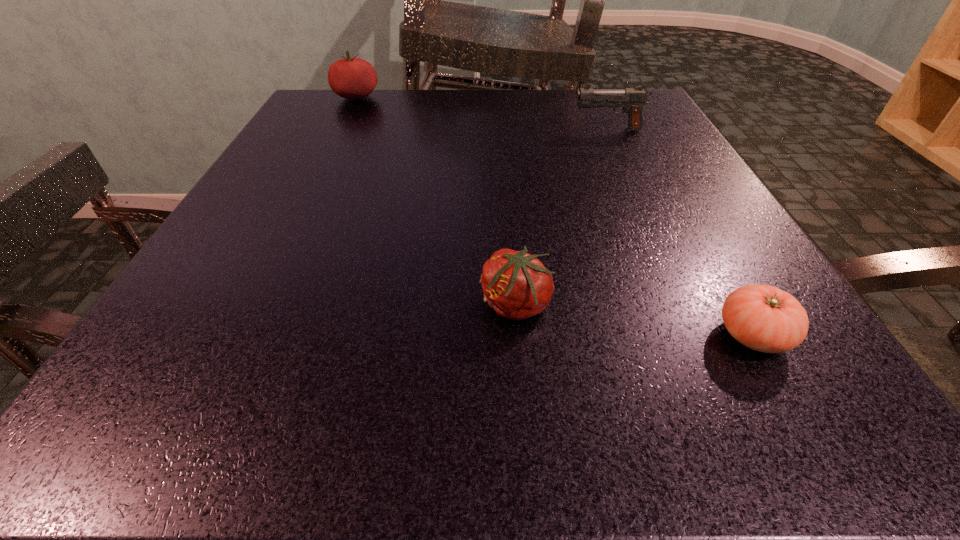
Where is `free location located on the back of the rightmost tomato`? free location located on the back of the rightmost tomato is located at coordinates (716, 271).

Where is `tomato that is at the far edge`? Image resolution: width=960 pixels, height=540 pixels. tomato that is at the far edge is located at coordinates (352, 78).

Where is `gun that is at the far edge`? gun that is at the far edge is located at coordinates (633, 99).

I want to click on object that is at the near edge, so click(x=764, y=318).

Find the location of `object that is at the left edge`. object that is at the left edge is located at coordinates tap(352, 78).

Find the location of a particular element. This screenshot has height=540, width=960. gun that is positioned at the right edge is located at coordinates (633, 99).

Where is `tomato present at the right edge`? The height and width of the screenshot is (540, 960). tomato present at the right edge is located at coordinates (764, 318).

At what (x,y) coordinates should I click in order to perform the action: click on object situated at the far left corner. Please return your answer as a coordinate pair (x, y). The width and height of the screenshot is (960, 540). Looking at the image, I should click on (352, 78).

Image resolution: width=960 pixels, height=540 pixels. In order to click on object that is at the far right corner in this screenshot , I will do `click(633, 99)`.

The width and height of the screenshot is (960, 540). I want to click on object that is at the near right corner, so pyautogui.click(x=764, y=318).